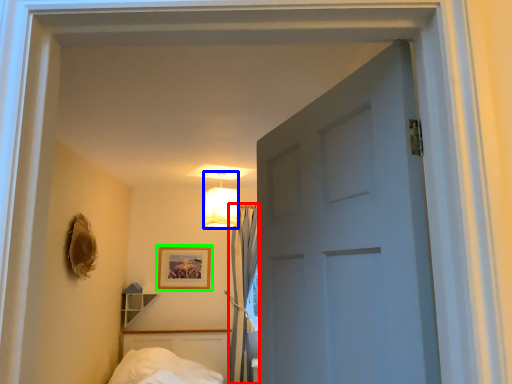
Question: Considering the real-world distances, which object is farthest from curtain (highlighted by a red box)? lamp (highlighted by a blue box) or picture frame (highlighted by a green box)?

Choices:
 (A) lamp
 (B) picture frame

Answer: (A)